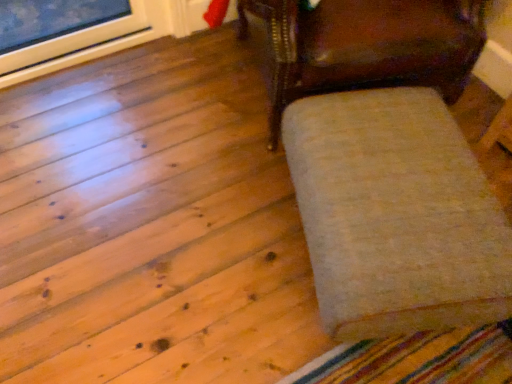
Where is `shiny dark wood chair at center`? Image resolution: width=512 pixels, height=384 pixels. shiny dark wood chair at center is located at coordinates (366, 46).

What do you see at coordinates (366, 46) in the screenshot?
I see `shiny dark wood chair at center` at bounding box center [366, 46].

Identify the location of white fluffy ottoman at right. pyautogui.click(x=395, y=214).

What do you see at coordinates (395, 214) in the screenshot? I see `white fluffy ottoman at right` at bounding box center [395, 214].

This screenshot has height=384, width=512. In order to click on shiny dark wood chair at center in this screenshot , I will do `click(366, 46)`.

Based on their positions, is shiny dark wood chair at center located to the left or right of white fluffy ottoman at right?

Based on their positions, shiny dark wood chair at center is located to the left of white fluffy ottoman at right.

Relative to white fluffy ottoman at right, is shiny dark wood chair at center in front or behind?

shiny dark wood chair at center is behind white fluffy ottoman at right.

Which is closer, (297, 69) or (423, 196)?

Point (297, 69) is farther from the camera than point (423, 196).

From the image's perspective, which one is positioned higher, shiny dark wood chair at center or white fluffy ottoman at right?

From the image's view, shiny dark wood chair at center is above.

From a real-world perspective, which is physically below, shiny dark wood chair at center or white fluffy ottoman at right?

Answer: white fluffy ottoman at right is physically lower.

Can you confirm if shiny dark wood chair at center is wider than white fluffy ottoman at right?

Indeed, shiny dark wood chair at center has a greater width compared to white fluffy ottoman at right.

Does shiny dark wood chair at center have a greater height compared to white fluffy ottoman at right?

Correct, shiny dark wood chair at center is much taller as white fluffy ottoman at right.

In terms of size, does shiny dark wood chair at center appear bigger or smaller than white fluffy ottoman at right?

Clearly, shiny dark wood chair at center is larger in size than white fluffy ottoman at right.

Is white fluffy ottoman at right surrounded by shiny dark wood chair at center?

Actually, white fluffy ottoman at right is outside shiny dark wood chair at center.

Are shiny dark wood chair at center and white fluffy ottoman at right located far from each other?

shiny dark wood chair at center is actually quite close to white fluffy ottoman at right.

Is shiny dark wood chair at center turned away from white fluffy ottoman at right?

No.

What's the angular difference between shiny dark wood chair at center and white fluffy ottoman at right's facing directions?

The facing directions of shiny dark wood chair at center and white fluffy ottoman at right are 2.72 degrees apart.

Identify the location of furniture that is on the right side of shiny dark wood chair at center. (395, 214).

In the image, is white fluffy ottoman at right on the left side or the right side of shiny dark wood chair at center?

In the image, white fluffy ottoman at right appears on the right side of shiny dark wood chair at center.

Is the depth of white fluffy ottoman at right less than that of shiny dark wood chair at center?

Yes, it is in front of shiny dark wood chair at center.

Is point (320, 160) positioned in front of point (414, 40)?

That is True.

From the image's perspective, is white fluffy ottoman at right above or below shiny dark wood chair at center?

Based on their image positions, white fluffy ottoman at right is located beneath shiny dark wood chair at center.

Consider the image. From a real-world perspective, which object rests below the other?

In real-world perspective, white fluffy ottoman at right is lower.

Considering the sizes of white fluffy ottoman at right and shiny dark wood chair at center in the image, is white fluffy ottoman at right wider or thinner than shiny dark wood chair at center?

Clearly, white fluffy ottoman at right has less width compared to shiny dark wood chair at center.

From their relative heights in the image, would you say white fluffy ottoman at right is taller or shorter than shiny dark wood chair at center?

Considering their sizes, white fluffy ottoman at right has less height than shiny dark wood chair at center.

In terms of size, does white fluffy ottoman at right appear bigger or smaller than shiny dark wood chair at center?

In the image, white fluffy ottoman at right appears to be smaller than shiny dark wood chair at center.

Would you say white fluffy ottoman at right is inside or outside shiny dark wood chair at center?

white fluffy ottoman at right cannot be found inside shiny dark wood chair at center.

From the picture: Is white fluffy ottoman at right with shiny dark wood chair at center?

They are not placed beside each other.

Is white fluffy ottoman at right aimed at shiny dark wood chair at center?

No, white fluffy ottoman at right is not aimed at shiny dark wood chair at center.

Measure the distance from white fluffy ottoman at right to shiny dark wood chair at center.

A distance of 12.82 inches exists between white fluffy ottoman at right and shiny dark wood chair at center.

You are a GUI agent. You are given a task and a screenshot of the screen. Output one action in this format:
    pyautogui.click(x=<x>, y=<y>)
    Task: Click on the furniture in front of the shiny dark wood chair at center
    The image size is (512, 384).
    Given the screenshot: What is the action you would take?
    pyautogui.click(x=395, y=214)

The height and width of the screenshot is (384, 512). I want to click on chair above the white fluffy ottoman at right (from a real-world perspective), so click(366, 46).

Locate an element on the screen. furniture in front of the shiny dark wood chair at center is located at coordinates (395, 214).